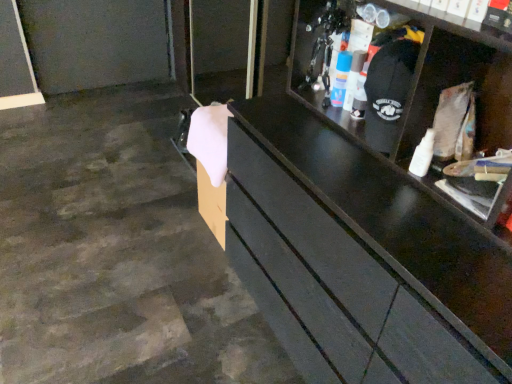
Question: Can you confirm if white glossy spray can at upper center, the first toiletry viewed from the left, is positioned to the left of matte plastic spray can at upper right, arranged as the second toiletry when viewed from the left?

Choices:
 (A) no
 (B) yes

Answer: (B)

Question: From a real-world perspective, is white glossy spray can at upper center, the first toiletry viewed from the left, over matte plastic spray can at upper right, positioned as the 1th toiletry in right-to-left order?

Choices:
 (A) yes
 (B) no

Answer: (B)

Question: Is white glossy spray can at upper center, the second toiletry in the right-to-left sequence, far away from matte plastic spray can at upper right, positioned as the 1th toiletry in right-to-left order?

Choices:
 (A) no
 (B) yes

Answer: (A)

Question: Could matte plastic spray can at upper right, positioned as the 1th toiletry in right-to-left order, be considered to be inside white glossy spray can at upper center, the first toiletry viewed from the left?

Choices:
 (A) no
 (B) yes

Answer: (A)

Question: Is white glossy spray can at upper center, the first toiletry viewed from the left, aimed at matte plastic spray can at upper right, positioned as the 1th toiletry in right-to-left order?

Choices:
 (A) yes
 (B) no

Answer: (B)

Question: Is the position of white glossy spray can at upper center, the first toiletry viewed from the left, less distant than that of matte plastic spray can at upper right, positioned as the 1th toiletry in right-to-left order?

Choices:
 (A) no
 (B) yes

Answer: (A)

Question: Considering the relative positions of matte plastic spray can at upper right, arranged as the second toiletry when viewed from the left, and white glossy spray can at upper center, the first toiletry viewed from the left, in the image provided, is matte plastic spray can at upper right, arranged as the second toiletry when viewed from the left, to the right of white glossy spray can at upper center, the first toiletry viewed from the left, from the viewer's perspective?

Choices:
 (A) no
 (B) yes

Answer: (B)

Question: Is white glossy spray can at upper center, the first toiletry viewed from the left, at the back of matte plastic spray can at upper right, arranged as the second toiletry when viewed from the left?

Choices:
 (A) yes
 (B) no

Answer: (B)

Question: Can you confirm if matte plastic spray can at upper right, arranged as the second toiletry when viewed from the left, is positioned to the left of white glossy spray can at upper center, the first toiletry viewed from the left?

Choices:
 (A) no
 (B) yes

Answer: (A)

Question: From a real-world perspective, is matte plastic spray can at upper right, arranged as the second toiletry when viewed from the left, below white glossy spray can at upper center, the second toiletry in the right-to-left sequence?

Choices:
 (A) no
 (B) yes

Answer: (A)

Question: From the image's perspective, is matte plastic spray can at upper right, positioned as the 1th toiletry in right-to-left order, below white glossy spray can at upper center, the second toiletry in the right-to-left sequence?

Choices:
 (A) no
 (B) yes

Answer: (B)

Question: Considering the relative sizes of matte plastic spray can at upper right, positioned as the 1th toiletry in right-to-left order, and white glossy spray can at upper center, the first toiletry viewed from the left, in the image provided, is matte plastic spray can at upper right, positioned as the 1th toiletry in right-to-left order, smaller than white glossy spray can at upper center, the first toiletry viewed from the left,?

Choices:
 (A) no
 (B) yes

Answer: (A)

Question: From the image's perspective, relative to matte plastic spray can at upper right, arranged as the second toiletry when viewed from the left, is white glossy spray can at upper center, the second toiletry in the right-to-left sequence, above or below?

Choices:
 (A) above
 (B) below

Answer: (A)